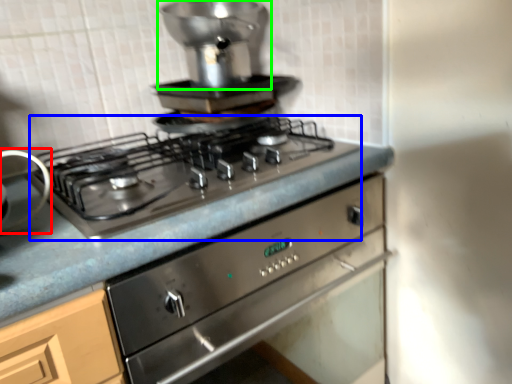
Question: Considering the real-world distances, which object is closest to appliance (highlighted by a red box)? gas stove (highlighted by a blue box) or appliance (highlighted by a green box).

Choices:
 (A) gas stove
 (B) appliance

Answer: (A)